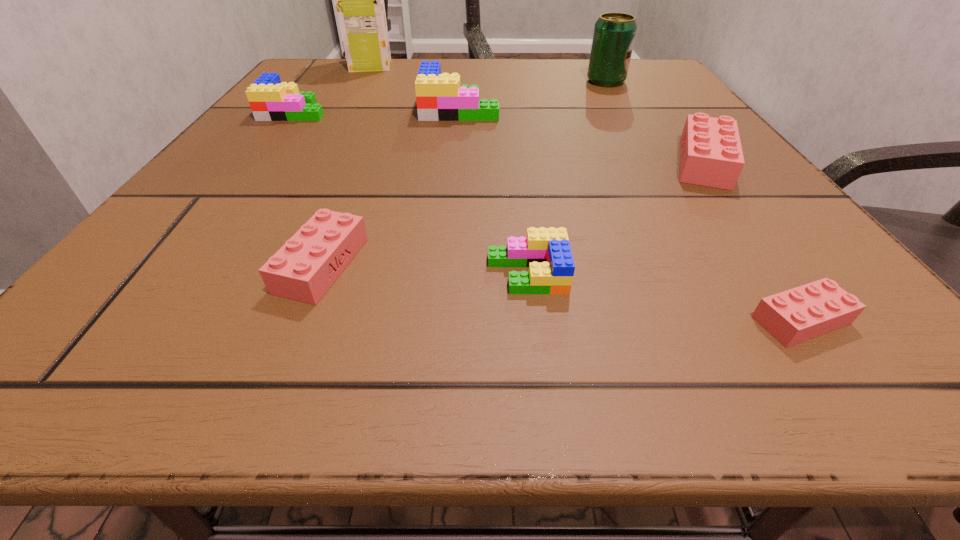
Choose which green Lego is the third nearest neighbor to the second Lego from left to right. Please provide its 2D coordinates. Your answer should be formatted as a tuple, i.e. [(x, y)], where the tuple contains the x and y coordinates of a point satisfying the conditions above.

[(270, 100)]

The image size is (960, 540). I want to click on the second closest pink Lego relative to the farthest object, so click(711, 155).

Locate an element on the screen. The width and height of the screenshot is (960, 540). pink Lego identified as the second closest to the farthest pink Lego is located at coordinates (306, 266).

Identify the location of vacant area in the image that satisfies the following two spatial constraints: 1. on the front side of the fourth nearest object; 2. on the left side of the second smallest green Lego. (256, 163).

Image resolution: width=960 pixels, height=540 pixels. Find the location of `free space in the image that satisfies the following two spatial constraints: 1. on the front side of the second farthest object; 2. on the right side of the tallest object`. free space in the image that satisfies the following two spatial constraints: 1. on the front side of the second farthest object; 2. on the right side of the tallest object is located at coordinates (362, 82).

I want to click on vacant area in the image that satisfies the following two spatial constraints: 1. on the front side of the second smallest green Lego; 2. on the right side of the smallest pink Lego, so click(138, 320).

Locate an element on the screen. vacant space that satisfies the following two spatial constraints: 1. on the front side of the leftmost Lego; 2. on the right side of the fifth Lego from right to left is located at coordinates pyautogui.click(x=180, y=265).